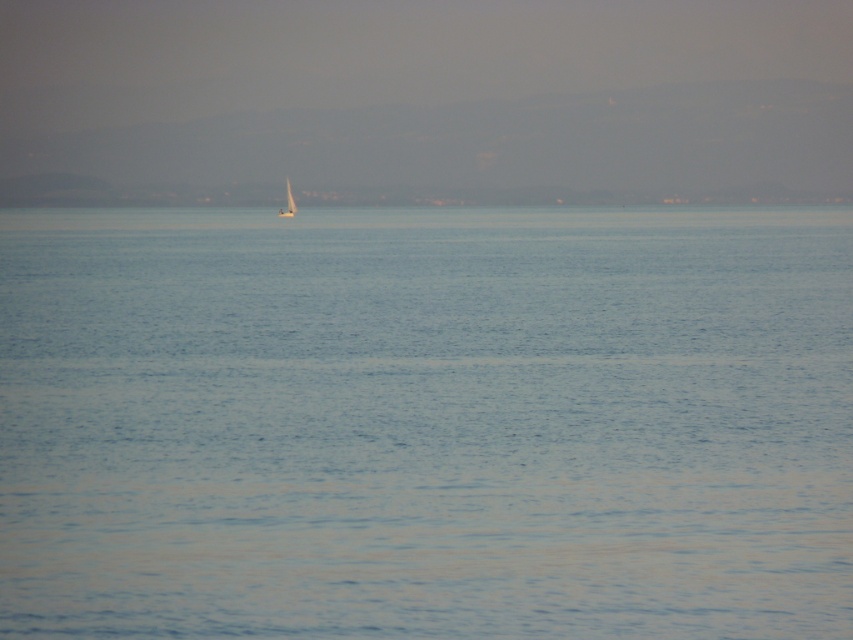
Question: Is blue smooth water at center positioned in front of blue water at center?

Choices:
 (A) no
 (B) yes

Answer: (B)

Question: Can you confirm if blue smooth water at center is thinner than white matte sailboat at center?

Choices:
 (A) yes
 (B) no

Answer: (B)

Question: Which point is farther to the camera?

Choices:
 (A) (288, 182)
 (B) (497, 380)
 (C) (281, 211)
 (D) (666, 195)

Answer: (D)

Question: Which object appears closest to the camera in this image?

Choices:
 (A) white sailboat at center
 (B) blue water at center
 (C) white matte sailboat at center
 (D) blue smooth water at center

Answer: (D)

Question: Does blue water at center appear on the right side of white matte sailboat at center?

Choices:
 (A) no
 (B) yes

Answer: (B)

Question: Based on their relative distances, which object is nearer to the blue smooth water at center?

Choices:
 (A) white sailboat at center
 (B) white matte sailboat at center
 (C) blue water at center

Answer: (B)